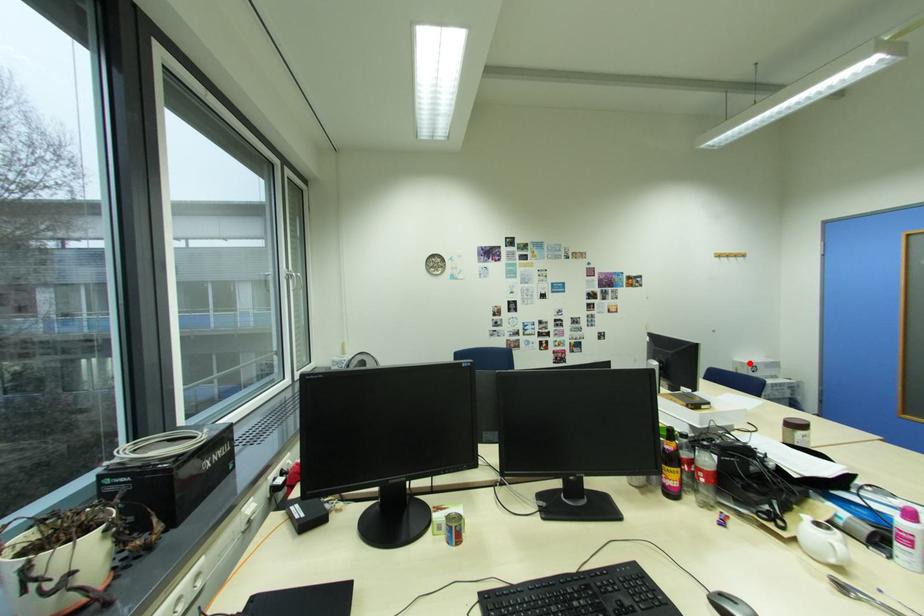
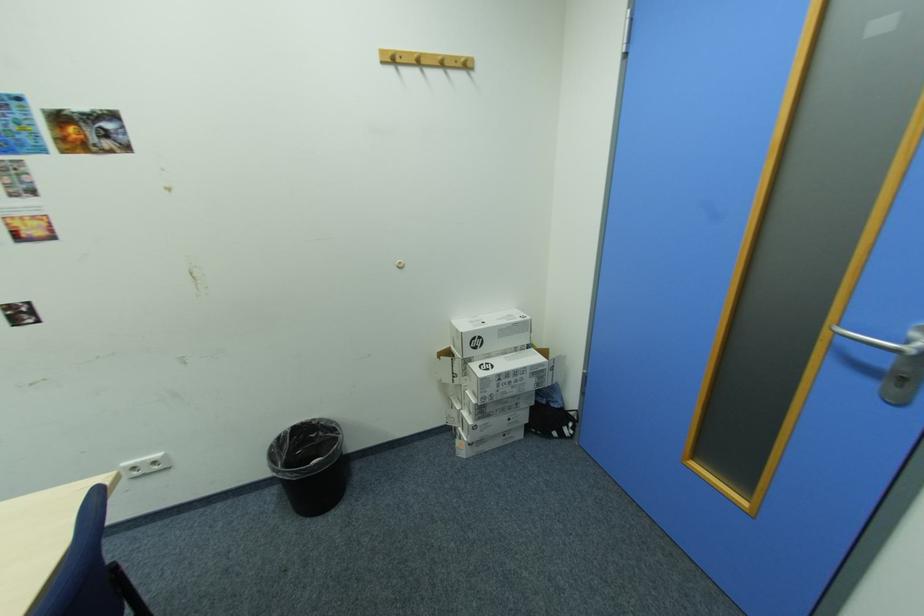
Locate, in the second image, the point that corresponds to the highlighted location in the first image.

(465, 331)